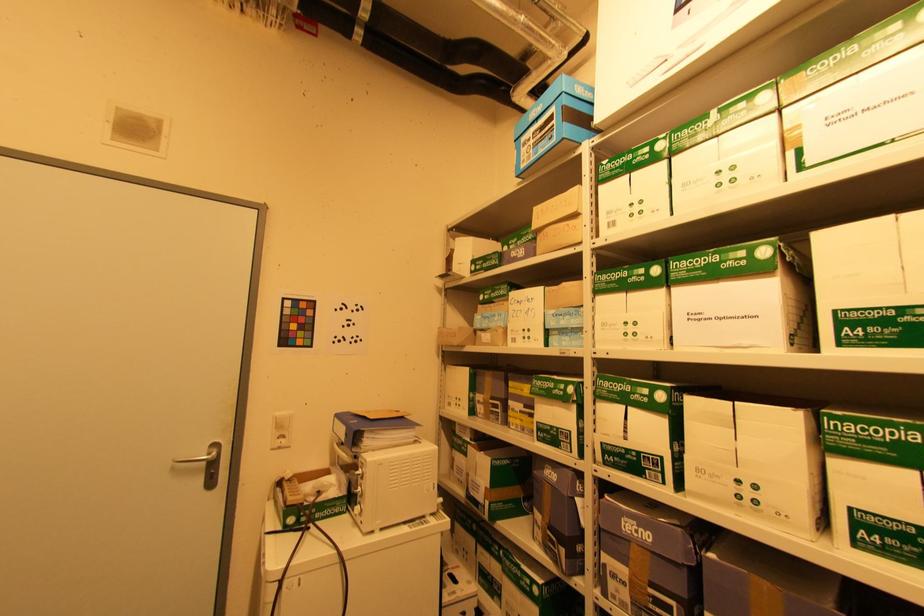
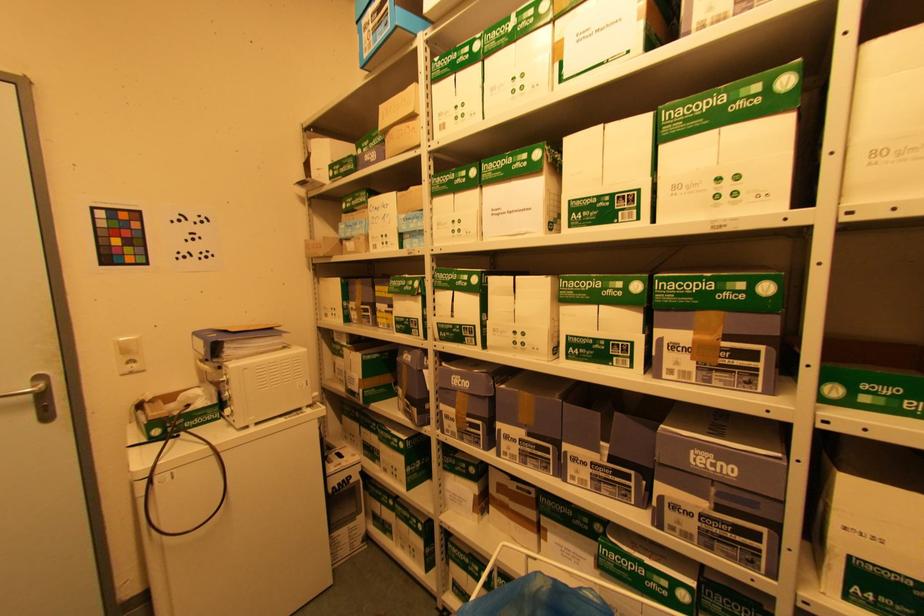
Question: The camera is either moving clockwise (left) or counter-clockwise (right) around the object. The first image is from the beginning of the video and the second image is from the end. Is the camera moving left or right when shooting the video?

Choices:
 (A) Left
 (B) Right

Answer: (A)